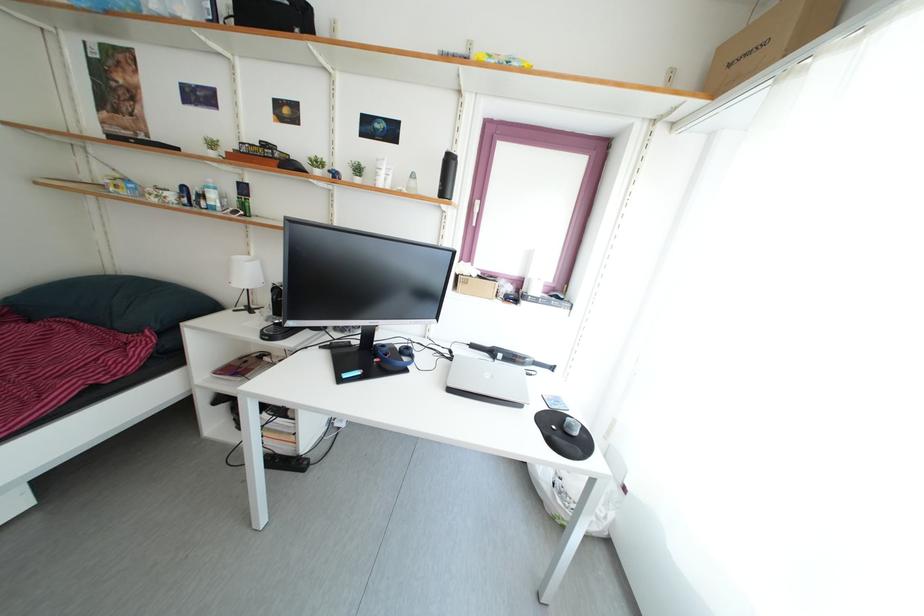
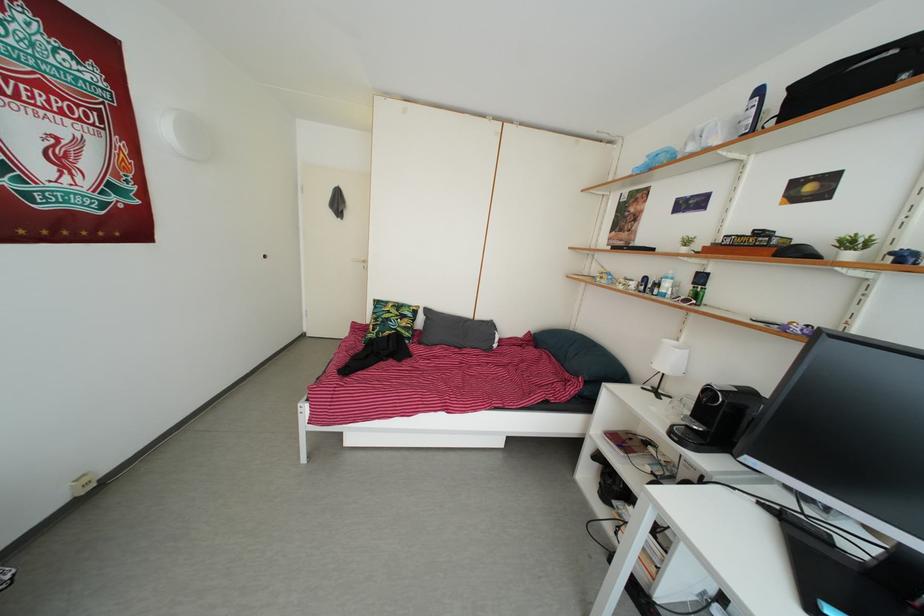
In the second image, find the point that corresponds to [275,325] in the first image.

(691, 424)